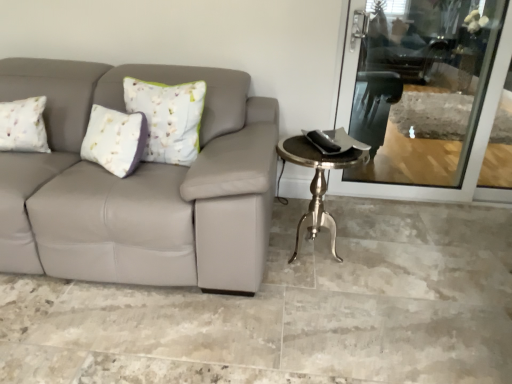
Question: From a real-world perspective, is silver metallic table at right physically located above or below metallic silver swivel chair at upper right?

Choices:
 (A) below
 (B) above

Answer: (A)

Question: From the image's perspective, is silver metallic table at right above or below metallic silver swivel chair at upper right?

Choices:
 (A) above
 (B) below

Answer: (B)

Question: Which is farther from the metallic silver swivel chair at upper right?

Choices:
 (A) silver metallic table at right
 (B) transparent glass screen door at upper right

Answer: (A)

Question: Estimate the real-world distances between objects in this image. Which object is farther from the transparent glass screen door at upper right?

Choices:
 (A) metallic silver swivel chair at upper right
 (B) silver metallic table at right

Answer: (B)